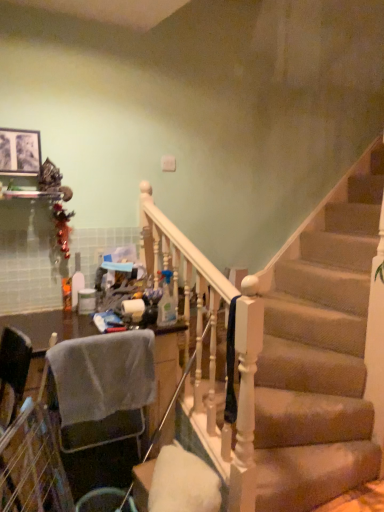
The image size is (384, 512). I want to click on metallic silver trash bin/can at lower left, so (x=105, y=501).

Measure the distance between metallic silver trash bin/can at lower left and translucent plastic spray bottle at center, the 2th bottle from the back.

The distance of metallic silver trash bin/can at lower left from translucent plastic spray bottle at center, the 2th bottle from the back, is 32.82 inches.

Image resolution: width=384 pixels, height=512 pixels. There is a metallic silver trash bin/can at lower left. In order to click on the 1st bottle above it (from the image's perspective) in this screenshot , I will do `click(166, 302)`.

From the image's perspective, relative to translucent plastic spray bottle at center, placed as the 2th bottle when sorted from left to right, is metallic silver trash bin/can at lower left above or below?

metallic silver trash bin/can at lower left is below translucent plastic spray bottle at center, placed as the 2th bottle when sorted from left to right.

Which object is wider, metallic silver trash bin/can at lower left or translucent plastic spray bottle at center, the first bottle viewed from the front?

With larger width is metallic silver trash bin/can at lower left.

In order to click on bottle that is in front of the translucent plastic bottle at center, positioned as the 2th bottle in right-to-left order in this screenshot , I will do `click(166, 302)`.

Is there a large distance between translucent plastic spray bottle at center, placed as the 2th bottle when sorted from left to right, and translucent plastic bottle at center, positioned as the 2th bottle in right-to-left order?

No, translucent plastic spray bottle at center, placed as the 2th bottle when sorted from left to right, is not far away from translucent plastic bottle at center, positioned as the 2th bottle in right-to-left order.

From the image's perspective, is translucent plastic spray bottle at center, the 2th bottle from the back, below translucent plastic bottle at center, positioned as the 2th bottle in right-to-left order?

Yes, from the image's perspective, translucent plastic spray bottle at center, the 2th bottle from the back, is below translucent plastic bottle at center, positioned as the 2th bottle in right-to-left order.

Considering the sizes of matte black picture frame at upper left and translucent plastic spray bottle at center, which ranks as the 1th bottle in right-to-left order, in the image, is matte black picture frame at upper left taller or shorter than translucent plastic spray bottle at center, which ranks as the 1th bottle in right-to-left order,?

matte black picture frame at upper left is shorter than translucent plastic spray bottle at center, which ranks as the 1th bottle in right-to-left order.

The height and width of the screenshot is (512, 384). Identify the location of picture frame located above the translucent plastic spray bottle at center, the first bottle viewed from the front (from the image's perspective). (20, 152).

Does matte black picture frame at upper left have a lesser width compared to translucent plastic spray bottle at center, which ranks as the 1th bottle in right-to-left order?

Indeed, matte black picture frame at upper left has a lesser width compared to translucent plastic spray bottle at center, which ranks as the 1th bottle in right-to-left order.

Which is correct: matte black picture frame at upper left is inside translucent plastic spray bottle at center, the 2th bottle from the back, or outside of it?

matte black picture frame at upper left is not enclosed by translucent plastic spray bottle at center, the 2th bottle from the back.

Considering the relative sizes of translucent plastic spray bottle at center, the first bottle viewed from the front, and metallic silver trash bin/can at lower left in the image provided, is translucent plastic spray bottle at center, the first bottle viewed from the front, bigger than metallic silver trash bin/can at lower left?

Incorrect, translucent plastic spray bottle at center, the first bottle viewed from the front, is not larger than metallic silver trash bin/can at lower left.

Is translucent plastic spray bottle at center, the first bottle viewed from the front, not near metallic silver trash bin/can at lower left?

No.

Starting from the metallic silver trash bin/can at lower left, which bottle is the 1st one behind? Please provide its 2D coordinates.

[(166, 302)]

Is metallic silver trash bin/can at lower left located within translucent plastic spray bottle at center, which ranks as the 1th bottle in right-to-left order?

That's incorrect, metallic silver trash bin/can at lower left is not inside translucent plastic spray bottle at center, which ranks as the 1th bottle in right-to-left order.

Is there a large distance between translucent plastic bottle at center, acting as the first bottle starting from the left, and metallic silver trash bin/can at lower left?

No.

Is translucent plastic bottle at center, which ranks as the first bottle in back-to-front order, positioned with its back to metallic silver trash bin/can at lower left?

No, translucent plastic bottle at center, which ranks as the first bottle in back-to-front order,'s orientation is not away from metallic silver trash bin/can at lower left.

Is translucent plastic bottle at center, acting as the first bottle starting from the left, positioned in front of metallic silver trash bin/can at lower left?

No, it is behind metallic silver trash bin/can at lower left.

Is translucent plastic bottle at center, which ranks as the first bottle in back-to-front order, positioned far away from matte black picture frame at upper left?

No, translucent plastic bottle at center, which ranks as the first bottle in back-to-front order, is not far from matte black picture frame at upper left.

Based on the photo, considering the sizes of objects translucent plastic bottle at center, acting as the first bottle starting from the left, and matte black picture frame at upper left in the image provided, who is shorter, translucent plastic bottle at center, acting as the first bottle starting from the left, or matte black picture frame at upper left?

Standing shorter between the two is matte black picture frame at upper left.

Identify the location of bottle that is the 1st one below the matte black picture frame at upper left (from a real-world perspective). Image resolution: width=384 pixels, height=512 pixels. (77, 281).

Does point (76, 263) appear closer or farther from the camera than point (175, 314)?

Clearly, point (76, 263) is more distant from the camera than point (175, 314).

Is translucent plastic bottle at center, positioned as the 2th bottle in right-to-left order, not within translucent plastic spray bottle at center, placed as the 2th bottle when sorted from left to right?

Indeed, translucent plastic bottle at center, positioned as the 2th bottle in right-to-left order, is completely outside translucent plastic spray bottle at center, placed as the 2th bottle when sorted from left to right.

From the image's perspective, which one is positioned higher, translucent plastic bottle at center, which ranks as the first bottle in back-to-front order, or translucent plastic spray bottle at center, which ranks as the 1th bottle in right-to-left order?

From the image's view, translucent plastic bottle at center, which ranks as the first bottle in back-to-front order, is above.

Between translucent plastic bottle at center, positioned as the 2th bottle in right-to-left order, and translucent plastic spray bottle at center, placed as the 2th bottle when sorted from left to right, which one appears on the left side from the viewer's perspective?

translucent plastic bottle at center, positioned as the 2th bottle in right-to-left order, is more to the left.

From the image's perspective, count 1st bottles upward from the metallic silver trash bin/can at lower left and point to it. Please provide its 2D coordinates.

[(166, 302)]

At what (x,y) coordinates should I click in order to perform the action: click on bottle that appears above the translucent plastic spray bottle at center, placed as the 2th bottle when sorted from left to right (from a real-world perspective). Please return your answer as a coordinate pair (x, y). The height and width of the screenshot is (512, 384). Looking at the image, I should click on (77, 281).

When comparing their distances from translucent plastic bottle at center, which ranks as the first bottle in back-to-front order, does metallic silver trash bin/can at lower left or matte black picture frame at upper left seem further?

Among the two, metallic silver trash bin/can at lower left is located further to translucent plastic bottle at center, which ranks as the first bottle in back-to-front order.

Which object lies further to the anchor point matte black picture frame at upper left, metallic silver trash bin/can at lower left or translucent plastic spray bottle at center, which ranks as the 1th bottle in right-to-left order?

The object further to matte black picture frame at upper left is metallic silver trash bin/can at lower left.

Which object lies nearer to the anchor point translucent plastic spray bottle at center, the 2th bottle from the back, metallic silver trash bin/can at lower left or matte black picture frame at upper left?

metallic silver trash bin/can at lower left lies closer to translucent plastic spray bottle at center, the 2th bottle from the back, than the other object.

Estimate the real-world distances between objects in this image. Which object is closer to translucent plastic spray bottle at center, the 2th bottle from the back, translucent plastic bottle at center, acting as the first bottle starting from the left, or matte black picture frame at upper left?

Among the two, translucent plastic bottle at center, acting as the first bottle starting from the left, is located nearer to translucent plastic spray bottle at center, the 2th bottle from the back.

From the image, which object appears to be farther from metallic silver trash bin/can at lower left, translucent plastic bottle at center, arranged as the 2th bottle when viewed from the front, or matte black picture frame at upper left?

Among the two, matte black picture frame at upper left is located further to metallic silver trash bin/can at lower left.

When comparing their distances from translucent plastic bottle at center, acting as the first bottle starting from the left, does translucent plastic spray bottle at center, which ranks as the 1th bottle in right-to-left order, or matte black picture frame at upper left seem further?

The object further to translucent plastic bottle at center, acting as the first bottle starting from the left, is matte black picture frame at upper left.

Estimate the real-world distances between objects in this image. Which object is closer to translucent plastic bottle at center, which ranks as the first bottle in back-to-front order, metallic silver trash bin/can at lower left or translucent plastic spray bottle at center, the first bottle viewed from the front?

The object closer to translucent plastic bottle at center, which ranks as the first bottle in back-to-front order, is translucent plastic spray bottle at center, the first bottle viewed from the front.

From the image, which object appears to be nearer to translucent plastic bottle at center, acting as the first bottle starting from the left, matte black picture frame at upper left or metallic silver trash bin/can at lower left?

Based on the image, matte black picture frame at upper left appears to be nearer to translucent plastic bottle at center, acting as the first bottle starting from the left.

Identify the location of bottle between translucent plastic bottle at center, which ranks as the first bottle in back-to-front order, and metallic silver trash bin/can at lower left in the up-down direction. (166, 302).

In order to click on bottle between matte black picture frame at upper left and translucent plastic spray bottle at center, the first bottle viewed from the front, in the up-down direction in this screenshot , I will do `click(77, 281)`.